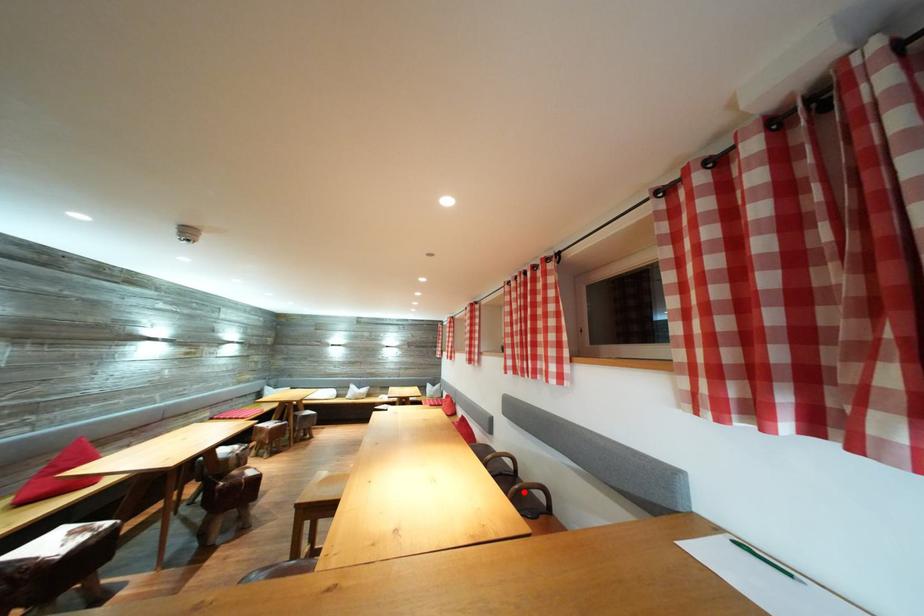
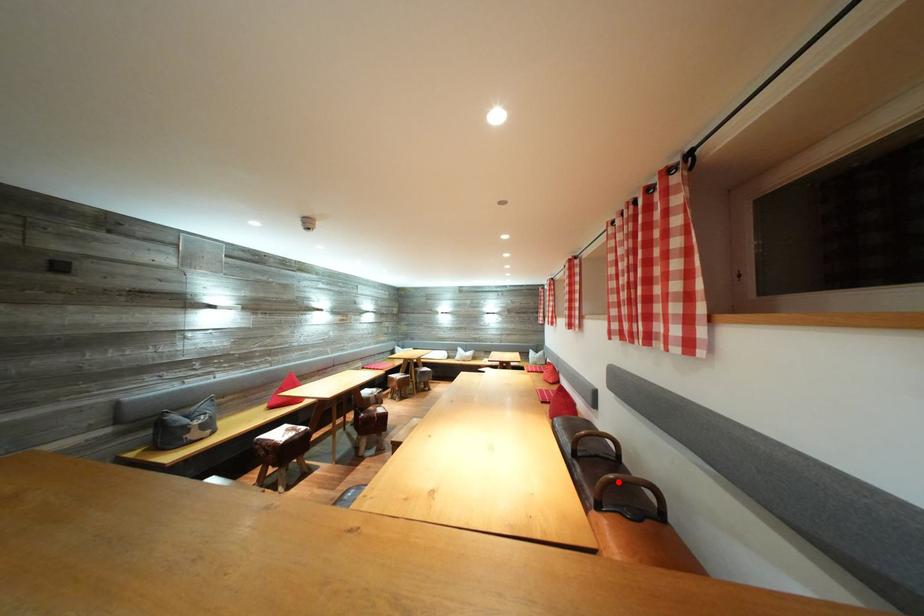
I am providing you with two images of the same scene from different viewpoints. A red point is marked on the first image and another point is marked on the second image. Is the red point in image1 aligned with the point shown in image2?

Yes